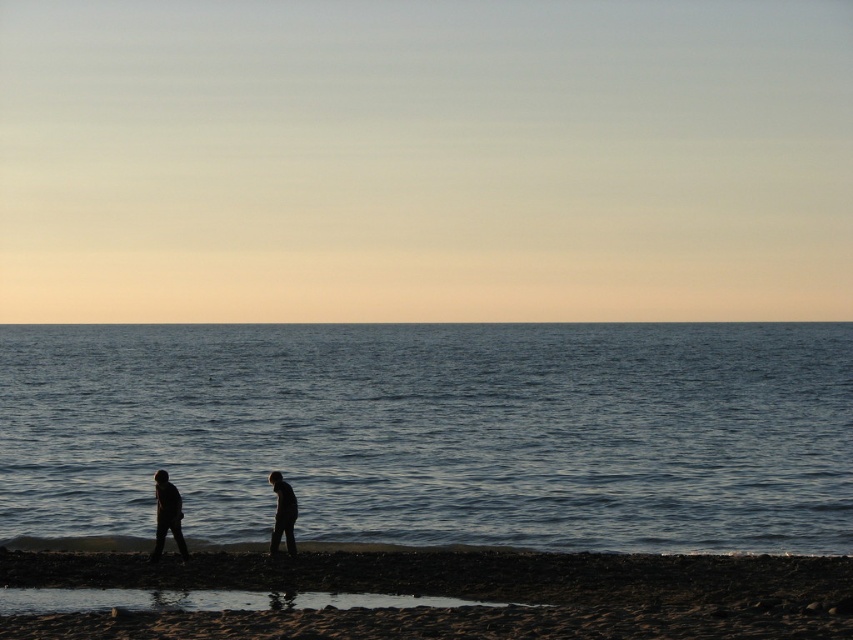
Question: Can you confirm if blue water at center is bigger than dark sand at lower center?

Choices:
 (A) yes
 (B) no

Answer: (A)

Question: Is blue water at center closer to the viewer compared to silhouette figures at lower center?

Choices:
 (A) yes
 (B) no

Answer: (B)

Question: Among these points, which one is nearest to the camera?

Choices:
 (A) (271, 472)
 (B) (164, 528)
 (C) (134, 412)

Answer: (B)

Question: Which point is farther to the camera?

Choices:
 (A) silhouette figure at lower center
 (B) blue water at center
 (C) silhouette figure at lower left

Answer: (B)

Question: Does blue water at center appear under silhouette figures at lower center?

Choices:
 (A) yes
 (B) no

Answer: (B)

Question: Which point is farther from the camera taking this photo?

Choices:
 (A) (171, 513)
 (B) (204, 483)
 (C) (273, 540)
 (D) (448, 630)

Answer: (B)